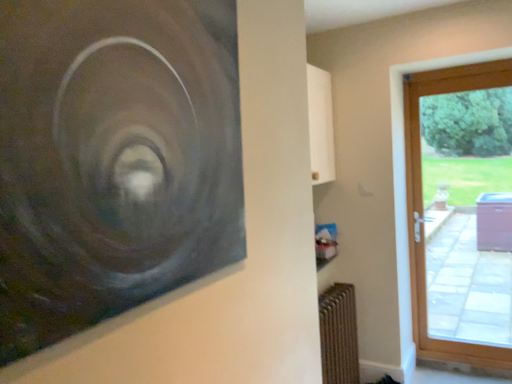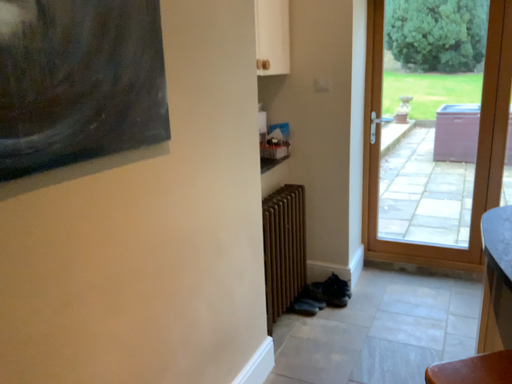
Question: Which way did the camera rotate in the video?

Choices:
 (A) rotated upward
 (B) rotated downward

Answer: (B)